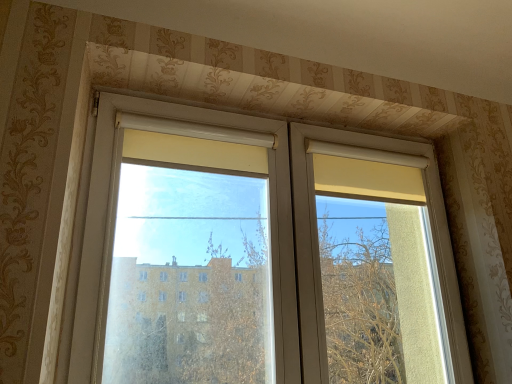
This screenshot has height=384, width=512. What are the coordinates of `transparent plastic window screen at center` in the screenshot? It's located at (187, 259).

This screenshot has height=384, width=512. What do you see at coordinates (187, 259) in the screenshot?
I see `transparent plastic window screen at center` at bounding box center [187, 259].

You are a GUI agent. You are given a task and a screenshot of the screen. Output one action in this format:
    pyautogui.click(x=<x>, y=<y>)
    Task: Click on the transparent glass window at center
    The image size is (512, 384).
    Given the screenshot: What is the action you would take?
    pyautogui.click(x=261, y=254)

Describe the element at coordinates (261, 254) in the screenshot. I see `transparent glass window at center` at that location.

Identify the location of transparent plastic window screen at center. (187, 259).

Considering the positions of objects transparent plastic window screen at center and transparent glass window at center in the image provided, who is more to the right, transparent plastic window screen at center or transparent glass window at center?

Positioned to the right is transparent glass window at center.

Does transparent plastic window screen at center come in front of transparent glass window at center?

Yes, it is.

Which is behind, point (218, 257) or point (304, 272)?

Point (218, 257)

From the image's perspective, is transparent plastic window screen at center above or below transparent glass window at center?

Based on their image positions, transparent plastic window screen at center is located above transparent glass window at center.

From a real-world perspective, is transparent plastic window screen at center under transparent glass window at center?

Yes, from a real-world perspective, transparent plastic window screen at center is beneath transparent glass window at center.

Is transparent plastic window screen at center thinner than transparent glass window at center?

In fact, transparent plastic window screen at center might be wider than transparent glass window at center.

Does transparent plastic window screen at center have a lesser height compared to transparent glass window at center?

Yes, transparent plastic window screen at center is shorter than transparent glass window at center.

Considering the relative sizes of transparent plastic window screen at center and transparent glass window at center in the image provided, is transparent plastic window screen at center smaller than transparent glass window at center?

Yes, transparent plastic window screen at center is smaller than transparent glass window at center.

Is transparent plastic window screen at center spatially inside transparent glass window at center, or outside of it?

transparent plastic window screen at center is enclosed within transparent glass window at center.

Is transparent plastic window screen at center next to transparent glass window at center and touching it?

Yes.

Is transparent plastic window screen at center oriented away from transparent glass window at center?

Yes, transparent plastic window screen at center is facing away from transparent glass window at center.

What's the angular difference between transparent plastic window screen at center and transparent glass window at center's facing directions?

They differ by 0.0007 degrees in their facing directions.

Measure the distance between transparent plastic window screen at center and transparent glass window at center.

They are 3.69 centimeters apart.

This screenshot has height=384, width=512. Find the location of `window screen above the transparent glass window at center (from the image's perspective)`. window screen above the transparent glass window at center (from the image's perspective) is located at coordinates (187, 259).

Is transparent glass window at center to the left or to the right of transparent plastic window screen at center in the image?

In the image, transparent glass window at center appears on the right side of transparent plastic window screen at center.

Considering the positions of objects transparent glass window at center and transparent plastic window screen at center in the image provided, who is behind, transparent glass window at center or transparent plastic window screen at center?

transparent glass window at center is further away from the camera.

Which is behind, point (334, 260) or point (196, 266)?

The point (196, 266) is behind.

From the image's perspective, which one is positioned lower, transparent glass window at center or transparent plastic window screen at center?

transparent glass window at center, from the image's perspective.

From a real-world perspective, is transparent glass window at center located higher than transparent plastic window screen at center?

Yes, from a real-world perspective, transparent glass window at center is on top of transparent plastic window screen at center.

Considering the relative sizes of transparent glass window at center and transparent plastic window screen at center in the image provided, is transparent glass window at center thinner than transparent plastic window screen at center?

Indeed, transparent glass window at center has a lesser width compared to transparent plastic window screen at center.

Can you confirm if transparent glass window at center is taller than transparent plastic window screen at center?

Correct, transparent glass window at center is much taller as transparent plastic window screen at center.

Is transparent glass window at center smaller than transparent plastic window screen at center?

No, transparent glass window at center is not smaller than transparent plastic window screen at center.

Is transparent glass window at center not inside transparent plastic window screen at center?

Actually, transparent glass window at center is at least partially inside transparent plastic window screen at center.

Is transparent glass window at center next to transparent plastic window screen at center and touching it?

Yes.

Does transparent glass window at center turn towards transparent plastic window screen at center?

Yes, transparent glass window at center faces towards transparent plastic window screen at center.

You are a GUI agent. You are given a task and a screenshot of the screen. Output one action in this format:
    pyautogui.click(x=<x>, y=<y>)
    Task: Click on the window that appears above the transparent plastic window screen at center (from a real-world perspective)
    Image resolution: width=512 pixels, height=384 pixels.
    Given the screenshot: What is the action you would take?
    pyautogui.click(x=261, y=254)

Find the location of a particular element. window below the transparent plastic window screen at center (from the image's perspective) is located at coordinates (261, 254).

In order to click on window above the transparent plastic window screen at center (from a real-world perspective) in this screenshot , I will do `click(261, 254)`.